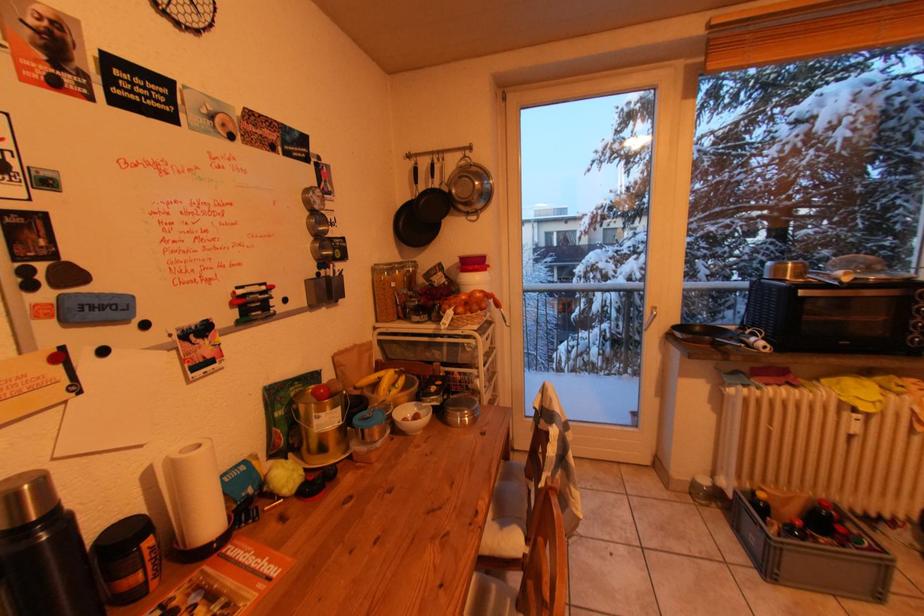
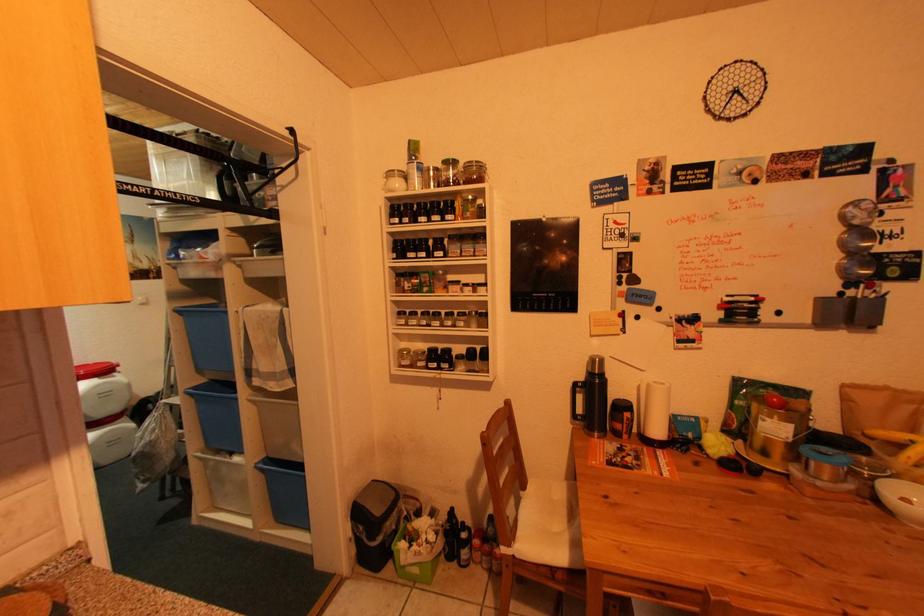
Question: The camera is either moving clockwise (left) or counter-clockwise (right) around the object. The first image is from the beginning of the video and the second image is from the end. Is the camera moving left or right when shooting the video?

Choices:
 (A) Left
 (B) Right

Answer: (B)